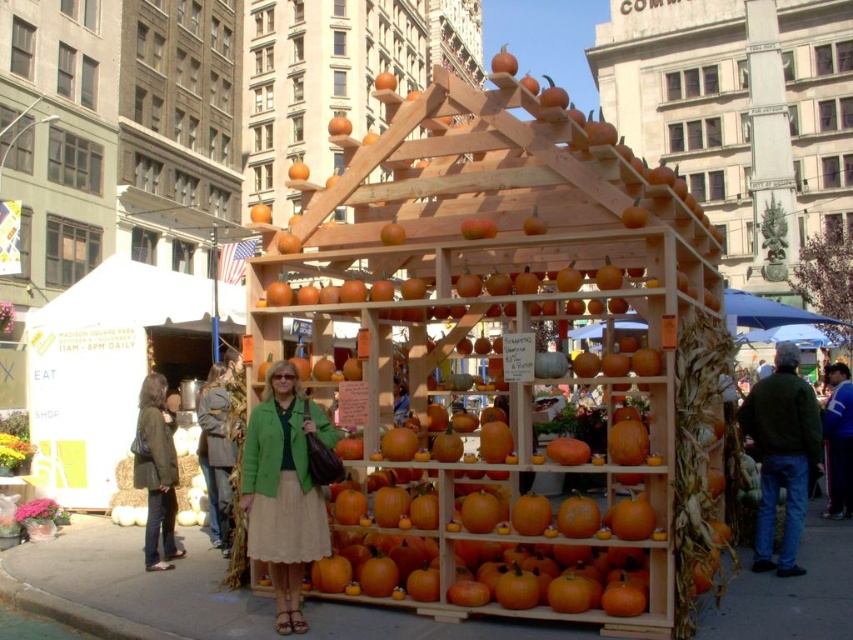
You are a photographer trying to capture both the green fabric jacket at center and the blue fleece jacket at lower right in one shot. Since you can only focus on one subject at a time, which jacket should you focus on to ensure the other remains in the background?

You should focus on the green fabric jacket at center because it is in front of the blue fleece jacket at lower right, so if you focus on the front jacket, the one behind will naturally be in the background.

You are a photographer trying to capture both the green fabric jacket at center and the dark green jacket at right in a single frame. Which jacket will appear smaller in the photo?

The green fabric jacket at center will appear smaller in the photo because it has a lesser height compared to the dark green jacket at right.

You are a photographer trying to capture the woman in the dark green jacket at right. To ensure she is centered in your shot, where should you position your camera relative to the pumpkin display?

The dark green jacket at right is located at point [782,454], so you should position your camera to the right side and lower portion of the pumpkin display to center the woman in the frame.